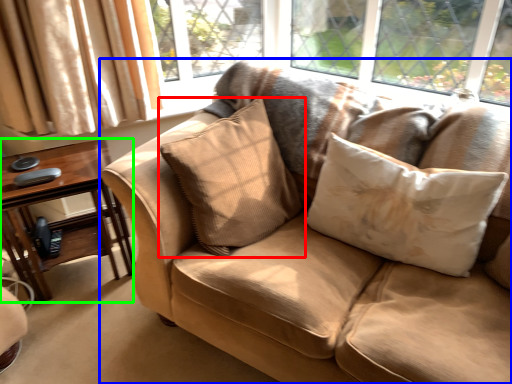
Question: Which is nearer to the pillow (highlighted by a red box)? studio couch (highlighted by a blue box) or table (highlighted by a green box).

Choices:
 (A) studio couch
 (B) table

Answer: (A)